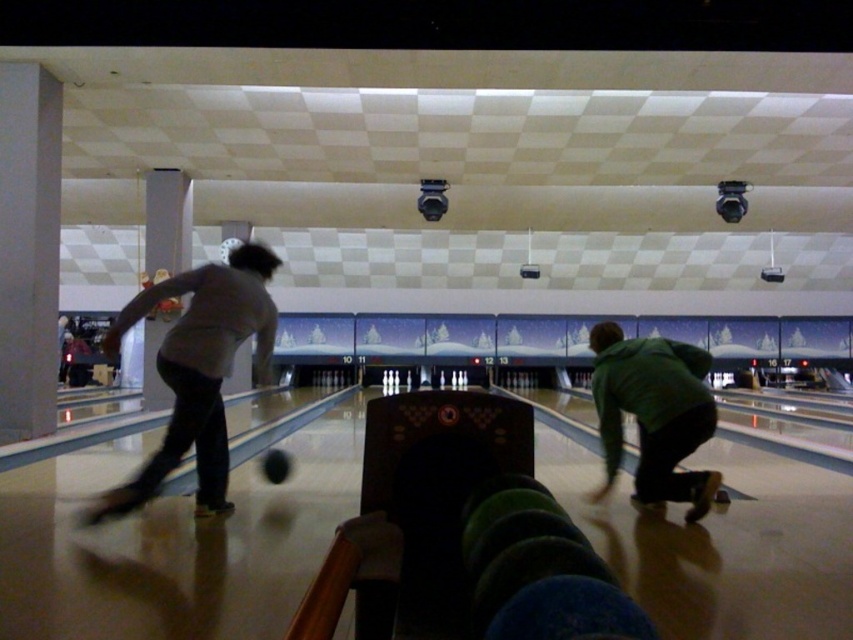
Is gray fabric shirt at left further to camera compared to green matte jacket at lower right?

No, gray fabric shirt at left is closer to the viewer.

Does gray fabric shirt at left appear over green matte jacket at lower right?

Indeed, gray fabric shirt at left is positioned over green matte jacket at lower right.

Image resolution: width=853 pixels, height=640 pixels. Find the location of `gray fabric shirt at left`. gray fabric shirt at left is located at coordinates (199, 371).

At what (x,y) coordinates should I click in order to perform the action: click on gray fabric shirt at left. Please return your answer as a coordinate pair (x, y). Looking at the image, I should click on (199, 371).

Is gray fabric shirt at left taller than shiny black bowling ball at center?

Yes, gray fabric shirt at left is taller than shiny black bowling ball at center.

Does gray fabric shirt at left have a larger size compared to shiny black bowling ball at center?

Indeed, gray fabric shirt at left has a larger size compared to shiny black bowling ball at center.

Image resolution: width=853 pixels, height=640 pixels. What do you see at coordinates (199, 371) in the screenshot?
I see `gray fabric shirt at left` at bounding box center [199, 371].

In order to click on gray fabric shirt at left in this screenshot , I will do `click(199, 371)`.

Can you confirm if green matte jacket at lower right is bigger than shiny black bowling ball at center?

Correct, green matte jacket at lower right is larger in size than shiny black bowling ball at center.

Can you confirm if green matte jacket at lower right is thinner than shiny black bowling ball at center?

No.

Which is in front, point (694, 490) or point (281, 470)?

Positioned in front is point (694, 490).

The image size is (853, 640). I want to click on green matte jacket at lower right, so click(x=654, y=413).